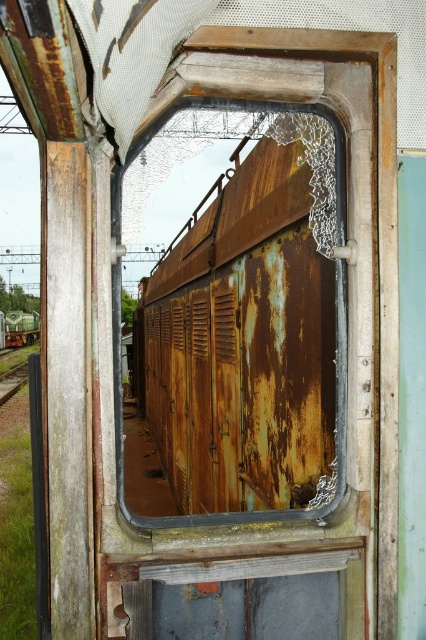
Question: Is rusty metal train at left thinner than brown wooden train track at left?

Choices:
 (A) no
 (B) yes

Answer: (B)

Question: Which object appears farthest from the camera in this image?

Choices:
 (A) brown wooden train track at left
 (B) rusty metal train at left

Answer: (B)

Question: Which of these objects is positioned closest to the brown wooden train track at left?

Choices:
 (A) rusty metal train at center
 (B) rusty metal train at left

Answer: (A)

Question: Does rusty metal train at left have a smaller size compared to brown wooden train track at left?

Choices:
 (A) yes
 (B) no

Answer: (A)

Question: Does rusty metal train at center come in front of brown wooden train track at left?

Choices:
 (A) yes
 (B) no

Answer: (A)

Question: Which point is closer to the camera?

Choices:
 (A) rusty metal train at left
 (B) rusty metal train at center

Answer: (B)